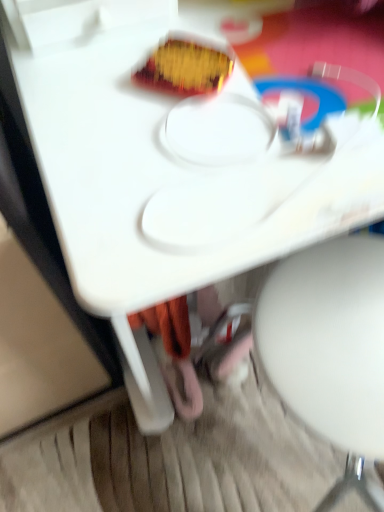
The width and height of the screenshot is (384, 512). What do you see at coordinates (185, 68) in the screenshot? I see `shiny plastic snack at upper center` at bounding box center [185, 68].

Locate an element on the screen. This screenshot has height=512, width=384. shiny plastic snack at upper center is located at coordinates (185, 68).

Identify the location of shiny plastic snack at upper center. This screenshot has width=384, height=512. (185, 68).